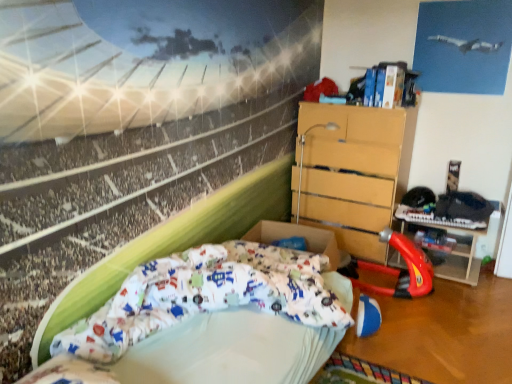
Question: From the image's perspective, is rubberized plastic toy at lower right under red plastic toy car at center right?

Choices:
 (A) yes
 (B) no

Answer: (B)

Question: Can you confirm if rubberized plastic toy at lower right is smaller than red plastic toy car at center right?

Choices:
 (A) yes
 (B) no

Answer: (A)

Question: Is rubberized plastic toy at lower right further to camera compared to red plastic toy car at center right?

Choices:
 (A) yes
 (B) no

Answer: (A)

Question: Is rubberized plastic toy at lower right closer to the viewer compared to red plastic toy car at center right?

Choices:
 (A) no
 (B) yes

Answer: (A)

Question: From a real-world perspective, is rubberized plastic toy at lower right located beneath red plastic toy car at center right?

Choices:
 (A) no
 (B) yes

Answer: (B)

Question: Is rubberized plastic toy at lower right shorter than red plastic toy car at center right?

Choices:
 (A) no
 (B) yes

Answer: (B)

Question: Is red plastic toy car at center right to the right of rubberized plastic toy at lower right from the viewer's perspective?

Choices:
 (A) yes
 (B) no

Answer: (B)

Question: Is the position of red plastic toy car at center right more distant than that of rubberized plastic toy at lower right?

Choices:
 (A) yes
 (B) no

Answer: (B)

Question: Is red plastic toy car at center right positioned before rubberized plastic toy at lower right?

Choices:
 (A) no
 (B) yes

Answer: (B)

Question: Is rubberized plastic toy at lower right located within red plastic toy car at center right?

Choices:
 (A) no
 (B) yes

Answer: (A)

Question: Does red plastic toy car at center right have a larger size compared to rubberized plastic toy at lower right?

Choices:
 (A) yes
 (B) no

Answer: (A)

Question: Is red plastic toy car at center right to the left of rubberized plastic toy at lower right from the viewer's perspective?

Choices:
 (A) yes
 (B) no

Answer: (A)

Question: Does rubberized plastic toy at lower right lie in front of white fabric bed at lower left?

Choices:
 (A) no
 (B) yes

Answer: (A)